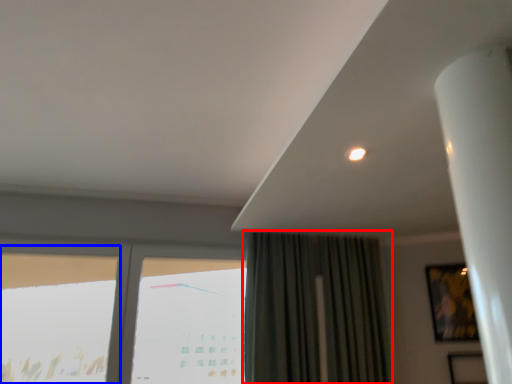
Question: Which of the following is the farthest to the observer, curtain (highlighted by a red box) or window (highlighted by a blue box)?

Choices:
 (A) curtain
 (B) window

Answer: (A)